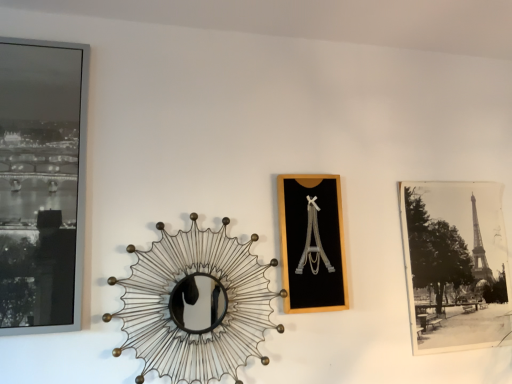
At what (x,y) coordinates should I click in order to perform the action: click on black paper photo at right, which ranks as the 1th picture frame in right-to-left order. Please return your answer as a coordinate pair (x, y). Looking at the image, I should click on (455, 265).

From their relative heights in the image, would you say black matte picture frame at center, the second picture frame viewed from the back, is taller or shorter than black paper photo at right, which ranks as the third picture frame in left-to-right order?

Clearly, black matte picture frame at center, the second picture frame viewed from the back, is shorter compared to black paper photo at right, which ranks as the third picture frame in left-to-right order.

Between point (342, 289) and point (417, 343), which one is positioned in front?

The point (342, 289) is more forward.

Are black matte picture frame at center, arranged as the 2th picture frame when viewed from the right, and black paper photo at right, which ranks as the 1th picture frame in right-to-left order, located far from each other?

That's not correct — black matte picture frame at center, arranged as the 2th picture frame when viewed from the right, is a little close to black paper photo at right, which ranks as the 1th picture frame in right-to-left order.

The image size is (512, 384). In the image, there is a matte black frame at left, the 1th picture frame from the front. In order to click on design below it (from a real-world perspective) in this screenshot , I will do `click(196, 305)`.

Considering the relative sizes of matte black frame at left, the 1th picture frame when ordered from left to right, and metallic wire sunburst mirror at center in the image provided, is matte black frame at left, the 1th picture frame when ordered from left to right, smaller than metallic wire sunburst mirror at center?

Indeed, matte black frame at left, the 1th picture frame when ordered from left to right, has a smaller size compared to metallic wire sunburst mirror at center.

Considering the positions of objects matte black frame at left, the 1th picture frame from the front, and metallic wire sunburst mirror at center in the image provided, who is more to the left, matte black frame at left, the 1th picture frame from the front, or metallic wire sunburst mirror at center?

From the viewer's perspective, matte black frame at left, the 1th picture frame from the front, appears more on the left side.

Is the position of matte black frame at left, the 1th picture frame when ordered from left to right, more distant than that of metallic wire sunburst mirror at center?

No, it is not.

There is a metallic wire sunburst mirror at center. Identify the location of the 1st picture frame above it (from a real-world perspective). This screenshot has width=512, height=384. (455, 265).

Between point (222, 246) and point (465, 329), which one is positioned in front?

The point (222, 246) is closer to the camera.

Is metallic wire sunburst mirror at center located outside black paper photo at right, which ranks as the third picture frame in left-to-right order?

Indeed, metallic wire sunburst mirror at center is completely outside black paper photo at right, which ranks as the third picture frame in left-to-right order.

Is black matte picture frame at center, arranged as the 2th picture frame when viewed from the right, aimed at metallic wire sunburst mirror at center?

No, black matte picture frame at center, arranged as the 2th picture frame when viewed from the right, is not turned towards metallic wire sunburst mirror at center.

Is black matte picture frame at center, arranged as the 2th picture frame when viewed from the right, with metallic wire sunburst mirror at center?

black matte picture frame at center, arranged as the 2th picture frame when viewed from the right, and metallic wire sunburst mirror at center are not in contact.

At what (x,y) coordinates should I click in order to perform the action: click on design below the black matte picture frame at center, positioned as the 2th picture frame in left-to-right order (from the image's perspective). Please return your answer as a coordinate pair (x, y). The image size is (512, 384). Looking at the image, I should click on (196, 305).

Which is behind, point (335, 273) or point (21, 190)?

The point (335, 273) is more distant.

Is black matte picture frame at center, the second picture frame viewed from the back, taller than matte black frame at left, the 1th picture frame from the front?

No, black matte picture frame at center, the second picture frame viewed from the back, is not taller than matte black frame at left, the 1th picture frame from the front.

From a real-world perspective, is black matte picture frame at center, arranged as the 2th picture frame when viewed from the right, located higher than matte black frame at left, acting as the 3th picture frame starting from the right?

No, from a real-world perspective, black matte picture frame at center, arranged as the 2th picture frame when viewed from the right, is not above matte black frame at left, acting as the 3th picture frame starting from the right.

From the image's perspective, is black matte picture frame at center, arranged as the 2th picture frame when viewed from the right, positioned above or below matte black frame at left, the 1th picture frame when ordered from left to right?

From the image's perspective, black matte picture frame at center, arranged as the 2th picture frame when viewed from the right, appears below matte black frame at left, the 1th picture frame when ordered from left to right.

From a real-world perspective, between matte black frame at left, the third picture frame in the back-to-front sequence, and black matte picture frame at center, positioned as the 2th picture frame in left-to-right order, who is vertically lower?

black matte picture frame at center, positioned as the 2th picture frame in left-to-right order, from a real-world perspective.

Which point is more forward, (80, 267) or (309, 268)?

The point (80, 267) is in front.

Is the depth of matte black frame at left, acting as the 3th picture frame starting from the right, greater than that of black matte picture frame at center, arranged as the 2th picture frame when viewed from the right?

No, it is not.

Between matte black frame at left, the third picture frame in the back-to-front sequence, and black matte picture frame at center, positioned as the 2th picture frame in left-to-right order, which one has smaller width?

Thinner between the two is black matte picture frame at center, positioned as the 2th picture frame in left-to-right order.

Where is `the 1st picture frame above when counting from the black paper photo at right, which is the 3th picture frame from front to back (from the image's perspective)`? The image size is (512, 384). the 1st picture frame above when counting from the black paper photo at right, which is the 3th picture frame from front to back (from the image's perspective) is located at coordinates (312, 243).

Looking at this image, is black paper photo at right, which ranks as the 1th picture frame in right-to-left order, inside or outside of black matte picture frame at center, which appears as the 2th picture frame when viewed from the front?

black paper photo at right, which ranks as the 1th picture frame in right-to-left order, is outside black matte picture frame at center, which appears as the 2th picture frame when viewed from the front.

Is black paper photo at right, which is the 1th picture frame in back-to-front order, not close to black matte picture frame at center, the second picture frame viewed from the back?

black paper photo at right, which is the 1th picture frame in back-to-front order, is near black matte picture frame at center, the second picture frame viewed from the back, not far away.

Find the location of a particular element. Image resolution: width=512 pixels, height=384 pixels. picture frame on the right of the black matte picture frame at center, which appears as the 2th picture frame when viewed from the front is located at coordinates (455, 265).

In order to click on design located below the matte black frame at left, the third picture frame in the back-to-front sequence (from the image's perspective) in this screenshot , I will do `click(196, 305)`.

Based on their spatial positions, is metallic wire sunburst mirror at center or black paper photo at right, which is the 1th picture frame in back-to-front order, closer to black matte picture frame at center, the second picture frame viewed from the back?

metallic wire sunburst mirror at center lies closer to black matte picture frame at center, the second picture frame viewed from the back, than the other object.

Looking at the image, which one is located closer to black paper photo at right, which ranks as the 1th picture frame in right-to-left order, black matte picture frame at center, the second picture frame viewed from the back, or metallic wire sunburst mirror at center?

Based on the image, black matte picture frame at center, the second picture frame viewed from the back, appears to be nearer to black paper photo at right, which ranks as the 1th picture frame in right-to-left order.

When comparing their distances from matte black frame at left, acting as the 3th picture frame starting from the right, does black matte picture frame at center, positioned as the 2th picture frame in left-to-right order, or metallic wire sunburst mirror at center seem further?

black matte picture frame at center, positioned as the 2th picture frame in left-to-right order, is further to matte black frame at left, acting as the 3th picture frame starting from the right.

Based on their spatial positions, is matte black frame at left, acting as the 3th picture frame starting from the right, or metallic wire sunburst mirror at center closer to black matte picture frame at center, which appears as the 2th picture frame when viewed from the front?

metallic wire sunburst mirror at center is positioned closer to the anchor black matte picture frame at center, which appears as the 2th picture frame when viewed from the front.

When comparing their distances from black paper photo at right, which is the 1th picture frame in back-to-front order, does black matte picture frame at center, positioned as the 2th picture frame in left-to-right order, or matte black frame at left, the 1th picture frame from the front, seem closer?

Among the two, black matte picture frame at center, positioned as the 2th picture frame in left-to-right order, is located nearer to black paper photo at right, which is the 1th picture frame in back-to-front order.

From the picture: When comparing their distances from metallic wire sunburst mirror at center, does black paper photo at right, which is the 1th picture frame in back-to-front order, or matte black frame at left, acting as the 3th picture frame starting from the right, seem closer?

Based on the image, matte black frame at left, acting as the 3th picture frame starting from the right, appears to be nearer to metallic wire sunburst mirror at center.

When comparing their distances from matte black frame at left, the third picture frame in the back-to-front sequence, does metallic wire sunburst mirror at center or black matte picture frame at center, the second picture frame viewed from the back, seem further?

The object further to matte black frame at left, the third picture frame in the back-to-front sequence, is black matte picture frame at center, the second picture frame viewed from the back.

Considering their positions, is matte black frame at left, the 1th picture frame from the front, positioned further to black paper photo at right, which ranks as the third picture frame in left-to-right order, than black matte picture frame at center, arranged as the 2th picture frame when viewed from the right?

The object further to black paper photo at right, which ranks as the third picture frame in left-to-right order, is matte black frame at left, the 1th picture frame from the front.

Where is `picture frame between metallic wire sunburst mirror at center and black paper photo at right, which is the 1th picture frame in back-to-front order`? This screenshot has height=384, width=512. picture frame between metallic wire sunburst mirror at center and black paper photo at right, which is the 1th picture frame in back-to-front order is located at coordinates (312, 243).

This screenshot has height=384, width=512. Identify the location of design situated between matte black frame at left, the 1th picture frame when ordered from left to right, and black paper photo at right, which is the 3th picture frame from front to back, from left to right. (196, 305).

Locate an element on the screen. Image resolution: width=512 pixels, height=384 pixels. picture frame between matte black frame at left, the 1th picture frame from the front, and black paper photo at right, which is the 1th picture frame in back-to-front order is located at coordinates (312, 243).

Where is `design situated between matte black frame at left, the 1th picture frame from the front, and black matte picture frame at center, which appears as the 2th picture frame when viewed from the front, from left to right`? design situated between matte black frame at left, the 1th picture frame from the front, and black matte picture frame at center, which appears as the 2th picture frame when viewed from the front, from left to right is located at coordinates point(196,305).